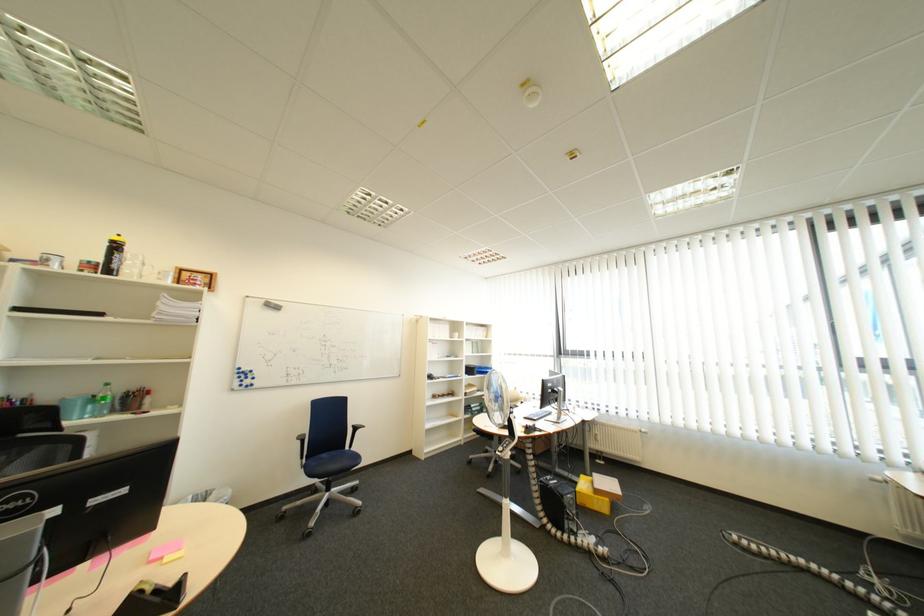
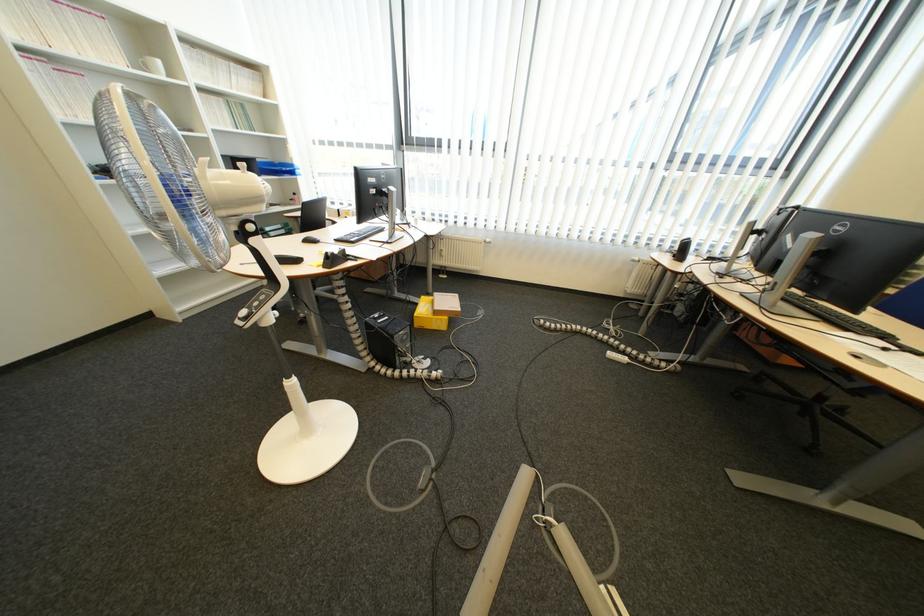
Locate, in the second image, the point that corresponds to the point at 495,368 in the first image.

(289, 163)